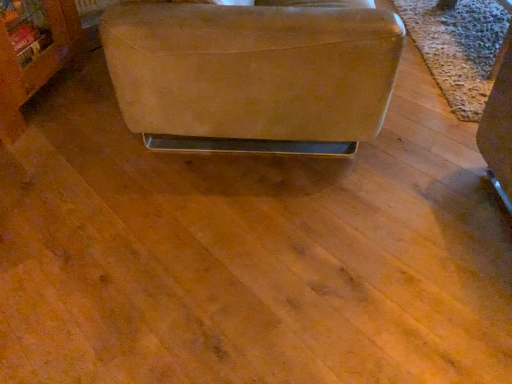
What do you see at coordinates (253, 74) in the screenshot?
I see `suede-like beige studio couch at center` at bounding box center [253, 74].

Locate an element on the screen. This screenshot has width=512, height=384. suede-like beige studio couch at center is located at coordinates (253, 74).

At what (x,y) coordinates should I click in order to perform the action: click on suede-like beige studio couch at center. Please return your answer as a coordinate pair (x, y). The height and width of the screenshot is (384, 512). Looking at the image, I should click on (253, 74).